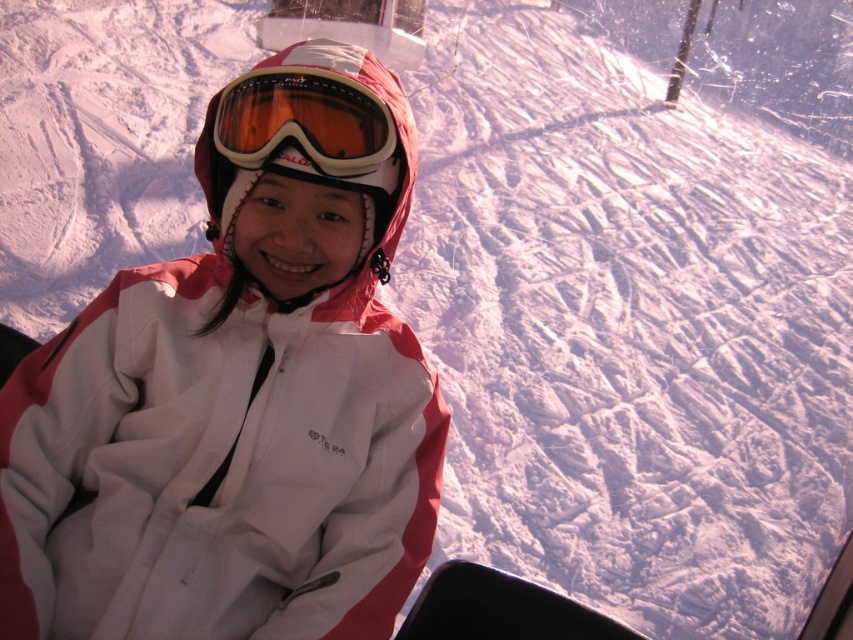
Between white/waterproof jacket at center and matte white helmet at center, which one is positioned lower?

Positioned lower is white/waterproof jacket at center.

What do you see at coordinates (238, 394) in the screenshot? I see `white/waterproof jacket at center` at bounding box center [238, 394].

Identify the location of white/waterproof jacket at center. Image resolution: width=853 pixels, height=640 pixels. (238, 394).

Does white/waterproof jacket at center have a lesser width compared to transparent orange lens goggles at center?

In fact, white/waterproof jacket at center might be wider than transparent orange lens goggles at center.

Is white/waterproof jacket at center further to camera compared to transparent orange lens goggles at center?

No, it is in front of transparent orange lens goggles at center.

Between point (300, 602) and point (334, 145), which one is positioned behind?

The point (300, 602) is behind.

What are the coordinates of `white/waterproof jacket at center` in the screenshot? It's located at (238, 394).

Can you confirm if matte white helmet at center is wider than transparent orange lens goggles at center?

Correct, the width of matte white helmet at center exceeds that of transparent orange lens goggles at center.

Is point (289, 154) positioned in front of point (340, 163)?

No.

This screenshot has width=853, height=640. In order to click on matte white helmet at center in this screenshot , I will do `click(312, 140)`.